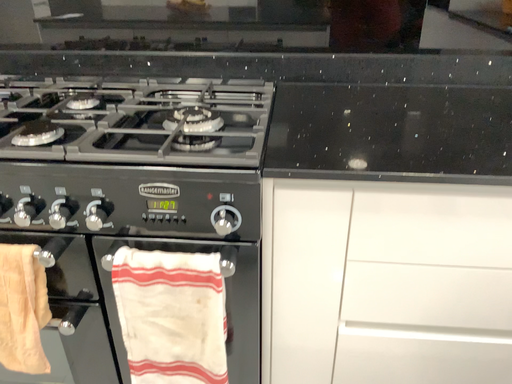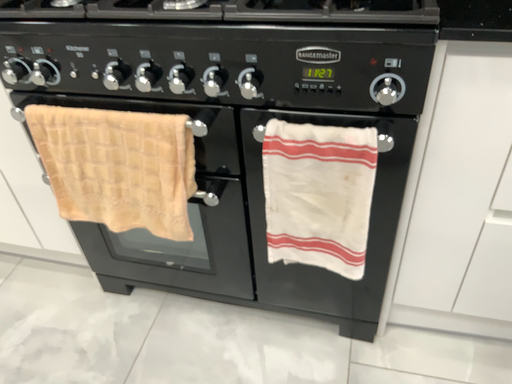
Question: How did the camera likely rotate when shooting the video?

Choices:
 (A) rotated downward
 (B) rotated upward

Answer: (A)